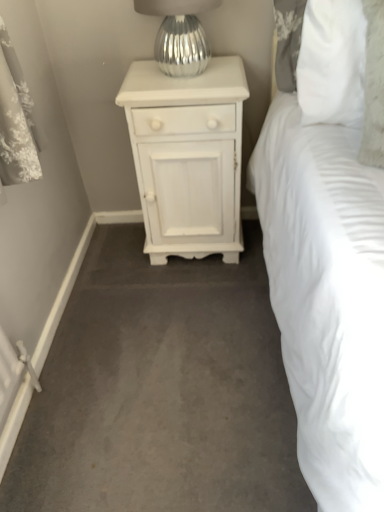
Question: Is white painted wood nightstand at center turned away from smooth gray carpet at center?

Choices:
 (A) no
 (B) yes

Answer: (A)

Question: Is white painted wood nightstand at center at the left side of smooth gray carpet at center?

Choices:
 (A) no
 (B) yes

Answer: (B)

Question: From a real-world perspective, is white painted wood nightstand at center on top of smooth gray carpet at center?

Choices:
 (A) yes
 (B) no

Answer: (A)

Question: Is white painted wood nightstand at center closer to the viewer compared to smooth gray carpet at center?

Choices:
 (A) yes
 (B) no

Answer: (B)

Question: Considering the relative sizes of white painted wood nightstand at center and smooth gray carpet at center in the image provided, is white painted wood nightstand at center bigger than smooth gray carpet at center?

Choices:
 (A) no
 (B) yes

Answer: (B)

Question: Is white painted wood nightstand at center behind smooth gray carpet at center?

Choices:
 (A) no
 (B) yes

Answer: (B)

Question: Can you confirm if smooth gray carpet at center is smaller than white painted wood nightstand at center?

Choices:
 (A) yes
 (B) no

Answer: (A)

Question: Is the depth of smooth gray carpet at center greater than that of white painted wood nightstand at center?

Choices:
 (A) yes
 (B) no

Answer: (B)

Question: Is smooth gray carpet at center in contact with white painted wood nightstand at center?

Choices:
 (A) no
 (B) yes

Answer: (A)

Question: From the image's perspective, is smooth gray carpet at center located beneath white painted wood nightstand at center?

Choices:
 (A) yes
 (B) no

Answer: (A)

Question: Is smooth gray carpet at center closer to camera compared to white painted wood nightstand at center?

Choices:
 (A) no
 (B) yes

Answer: (B)

Question: Can you confirm if smooth gray carpet at center is wider than white painted wood nightstand at center?

Choices:
 (A) no
 (B) yes

Answer: (B)

Question: Can you see white painted wood nightstand at center touching silver metallic vase at upper center?

Choices:
 (A) no
 (B) yes

Answer: (A)